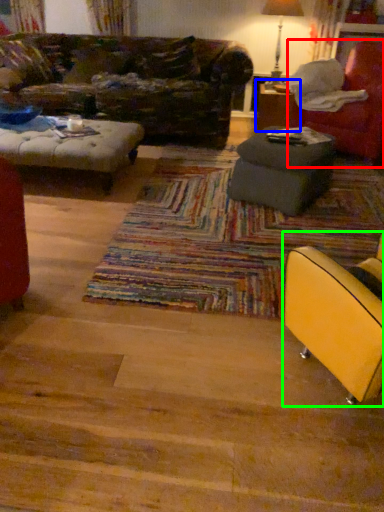
Question: Which is nearer to the chair (highlighted by a red box)? table (highlighted by a blue box) or chair (highlighted by a green box).

Choices:
 (A) table
 (B) chair

Answer: (A)